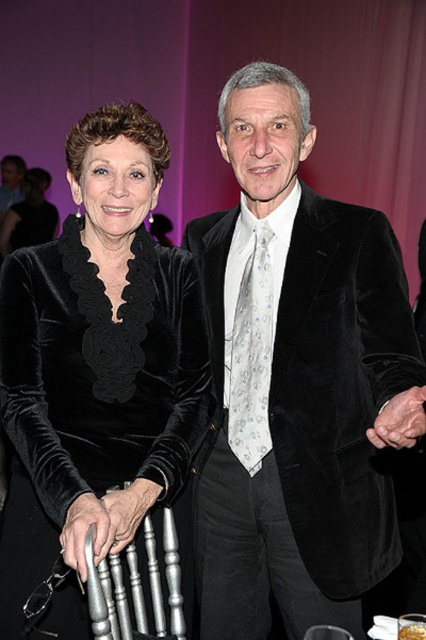
Question: Is velvet black suit at center positioned before velvet black dress at center?

Choices:
 (A) no
 (B) yes

Answer: (B)

Question: Is velvet black suit at center closer to camera compared to velvet black dress at center?

Choices:
 (A) yes
 (B) no

Answer: (A)

Question: Does velvet black suit at center appear on the right side of velvet black dress at center?

Choices:
 (A) no
 (B) yes

Answer: (B)